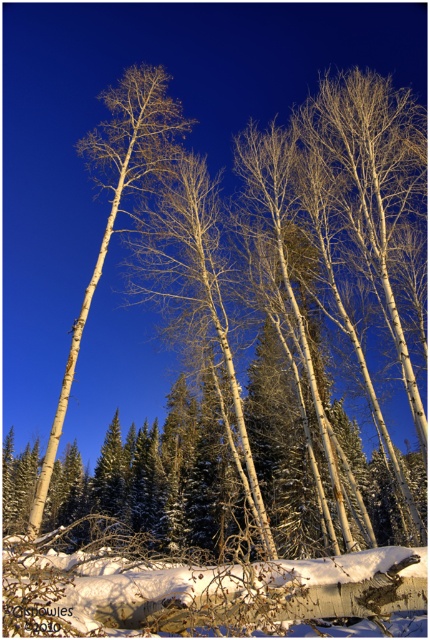
Can you confirm if white fluffy snow at lower center is smaller than white matte birch tree at left?

Yes.

Who is shorter, white fluffy snow at lower center or white matte birch tree at left?

white fluffy snow at lower center

Identify the location of white fluffy snow at lower center. (205, 593).